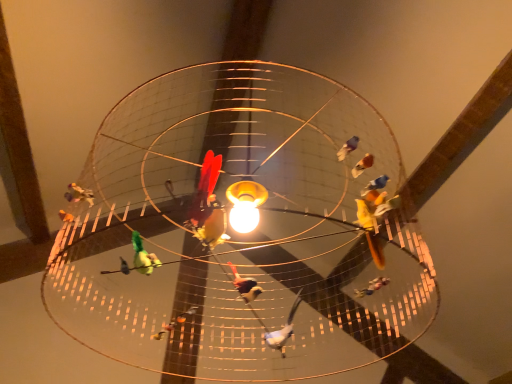
The height and width of the screenshot is (384, 512). I want to click on matte gold lamp at center, so click(x=241, y=230).

What do you see at coordinates (241, 230) in the screenshot? This screenshot has height=384, width=512. I see `matte gold lamp at center` at bounding box center [241, 230].

You are a GUI agent. You are given a task and a screenshot of the screen. Output one action in this format:
    pyautogui.click(x=<x>, y=<y>)
    Task: Click on the matte gold lamp at center
    Image resolution: width=512 pixels, height=384 pixels.
    Given the screenshot: What is the action you would take?
    pyautogui.click(x=241, y=230)